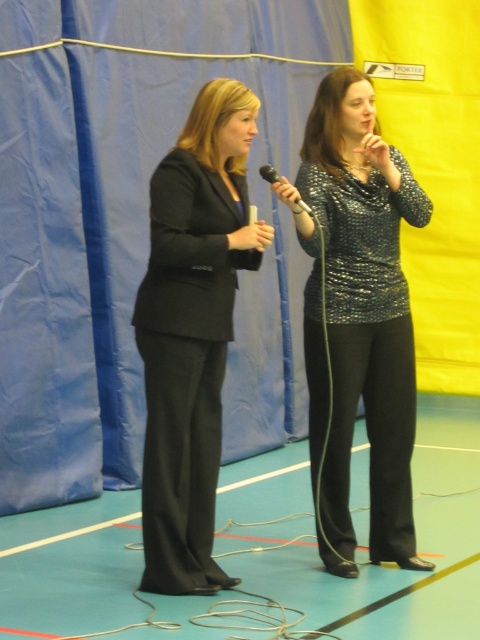
You are a photographer positioned at the entrance of the gymnasium. You need to capture a photo of the sparkly silver blouse at center. According to the coordinates provided, where should you aim your camera to ensure the blouse is centered in the frame?

The sparkly silver blouse at center is located at point coordinates [359,316], so you should aim your camera at those coordinates to center it in the frame.